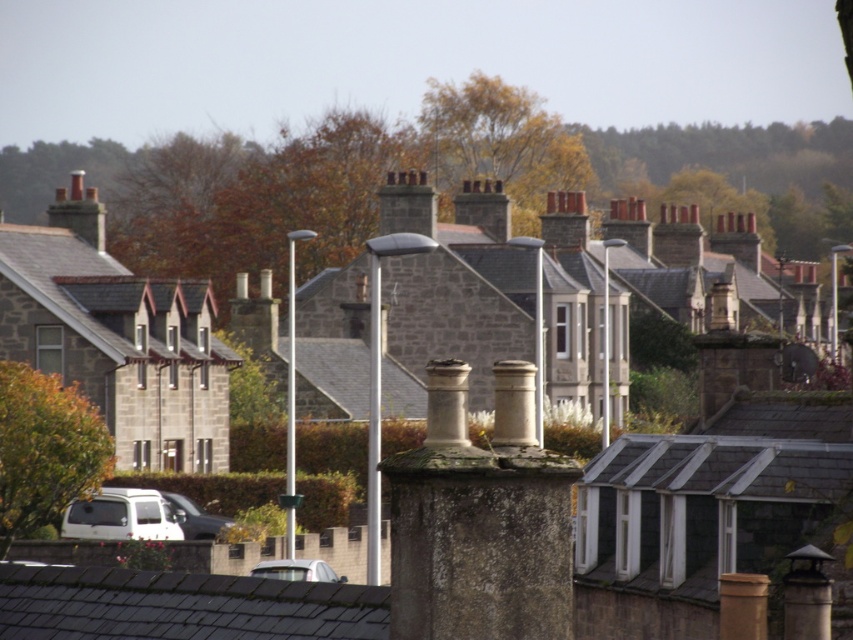
You are driving a car that is 5 meters long and need to park between the silver metallic car at lower left and the white matte car at lower center. Is there enough space to park your car without touching either car?

The distance between the silver metallic car at lower left and the white matte car at lower center is 6.71 meters. Since your car is 5 meters long, there is enough space to park between them without touching either car.

Consider the image. You are standing in front of the row of stone houses and notice a silver metallic car at lower left. Based on its position coordinates, can you determine if the car is closer to the foreground house or the background houses?

The silver metallic car at lower left is located at point [194,516], which places it closer to the foreground house since the foreground house is the one in the immediate view, and the coordinates suggest proximity to the lower left area where the foreground is depicted.

You are driving a delivery van and need to park it near the stone chimney at center. The parking space must be exactly 20 meters away from the chimney. Given the current position of the white matte van at lower left, can you park your van in a spot that meets the requirement?

The stone chimney at center is 19.75 meters from the white matte van at lower left, which is just 0.25 meters short of the required 20 meters. Therefore, you can park your van slightly further away from the chimney than the current position of the white matte van at lower left to meet the 20 meter requirement.